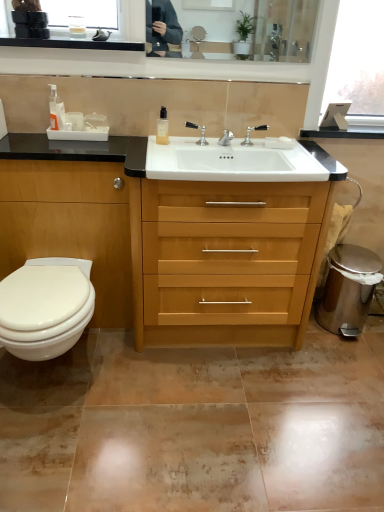
At what (x,y) coordinates should I click in order to perform the action: click on free location in front of clear glass bottle at center, positioned as the 1th toiletry in right-to-left order. Please return your answer as a coordinate pair (x, y). Image resolution: width=384 pixels, height=512 pixels. Looking at the image, I should click on (171, 154).